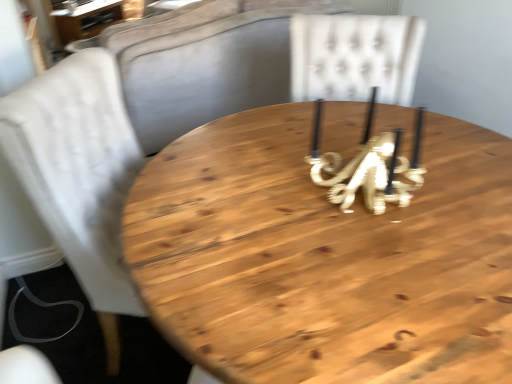
Locate an element on the screen. This screenshot has width=512, height=384. white fabric chair at left is located at coordinates (80, 174).

From a real-world perspective, which table is the 1st one underneath the white fabric chair at left? Please provide its 2D coordinates.

[(324, 258)]

From a real-world perspective, which object rests below the other?

natural wood table at center, which appears as the 1th table when viewed from the front.

Considering the sizes of objects natural wood table at center, which appears as the 1th table when ordered from the bottom, and white fabric chair at left in the image provided, who is taller, natural wood table at center, which appears as the 1th table when ordered from the bottom, or white fabric chair at left?

natural wood table at center, which appears as the 1th table when ordered from the bottom, is taller.

Is there a large distance between natural wood table at center, which ranks as the 2th table in left-to-right order, and white fabric chair at left?

They are positioned close to each other.

From the image's perspective, which object appears higher, wooden table at upper left, which ranks as the second table in front-to-back order, or white fabric chair at left?

wooden table at upper left, which ranks as the second table in front-to-back order, is shown above in the image.

Does wooden table at upper left, which is the 1th table in top-to-bottom order, come behind white fabric chair at left?

Yes, it is behind white fabric chair at left.

In order to click on table that is behind the white fabric chair at left in this screenshot , I will do `click(87, 19)`.

Can you confirm if wooden table at upper left, which is the 1th table in top-to-bottom order, is wider than white fabric chair at left?

No.

Which of these two, wooden table at upper left, acting as the 1th table starting from the left, or natural wood table at center, arranged as the 2th table when viewed from the back, stands shorter?

wooden table at upper left, acting as the 1th table starting from the left, is shorter.

From the image's perspective, would you say wooden table at upper left, which is the 1th table in top-to-bottom order, is shown under natural wood table at center, which appears as the 1th table when ordered from the bottom?

No.

Based on their sizes in the image, would you say wooden table at upper left, which is the 1th table in top-to-bottom order, is bigger or smaller than natural wood table at center, which is the first table from right to left?

Clearly, wooden table at upper left, which is the 1th table in top-to-bottom order, is smaller in size than natural wood table at center, which is the first table from right to left.

From a real-world perspective, is wooden table at upper left, which is the 1th table in back-to-front order, under natural wood table at center, which appears as the 1th table when viewed from the front?

Correct, in the physical world, wooden table at upper left, which is the 1th table in back-to-front order, is lower than natural wood table at center, which appears as the 1th table when viewed from the front.

From the image's perspective, is white fabric chair at left on wooden table at upper left, acting as the 1th table starting from the left?

No.

Is white fabric chair at left shorter than wooden table at upper left, which ranks as the second table in bottom-to-top order?

In fact, white fabric chair at left may be taller than wooden table at upper left, which ranks as the second table in bottom-to-top order.

Is white fabric chair at left far away from wooden table at upper left, which is the 1th table in back-to-front order?

Yes, white fabric chair at left and wooden table at upper left, which is the 1th table in back-to-front order, are located far from each other.

Based on the photo, is natural wood table at center, which appears as the 1th table when viewed from the front, in contact with wooden table at upper left, the second table when ordered from right to left?

No, natural wood table at center, which appears as the 1th table when viewed from the front, is not touching wooden table at upper left, the second table when ordered from right to left.

From the image's perspective, relative to wooden table at upper left, which is the 1th table in back-to-front order, is natural wood table at center, which is the first table from right to left, above or below?

Clearly, from the image's perspective, natural wood table at center, which is the first table from right to left, is below wooden table at upper left, which is the 1th table in back-to-front order.

From a real-world perspective, is natural wood table at center, arranged as the 2th table when viewed from the back, over wooden table at upper left, which is the 1th table in back-to-front order?

Yes, from a real-world perspective, natural wood table at center, arranged as the 2th table when viewed from the back, is over wooden table at upper left, which is the 1th table in back-to-front order

Which object is closer to the camera taking this photo, natural wood table at center, which appears as the 1th table when ordered from the bottom, or wooden table at upper left, acting as the 1th table starting from the left?

natural wood table at center, which appears as the 1th table when ordered from the bottom, is closer to the camera.

Which of these two, white fabric chair at left or natural wood table at center, arranged as the 2th table when viewed from the back, stands shorter?

white fabric chair at left is shorter.

Consider the image. Is white fabric chair at left directly adjacent to natural wood table at center, which ranks as the 2th table in left-to-right order?

white fabric chair at left and natural wood table at center, which ranks as the 2th table in left-to-right order, are clearly separated.

Considering the points (42, 80) and (324, 144), which point is in front, point (42, 80) or point (324, 144)?

Point (42, 80)

In terms of size, does white fabric chair at left appear bigger or smaller than natural wood table at center, which appears as the 1th table when ordered from the bottom?

Clearly, white fabric chair at left is larger in size than natural wood table at center, which appears as the 1th table when ordered from the bottom.

The height and width of the screenshot is (384, 512). I want to click on table in front of the white fabric chair at left, so click(324, 258).

Image resolution: width=512 pixels, height=384 pixels. I want to click on table behind the white fabric chair at left, so click(x=87, y=19).

Which object lies nearer to the anchor point white fabric chair at left, wooden table at upper left, which ranks as the second table in bottom-to-top order, or natural wood table at center, arranged as the 2th table when viewed from the back?

Based on the image, natural wood table at center, arranged as the 2th table when viewed from the back, appears to be nearer to white fabric chair at left.

Considering their positions, is wooden table at upper left, which ranks as the second table in front-to-back order, positioned closer to natural wood table at center, which is the first table from right to left, than white fabric chair at left?

The object closer to natural wood table at center, which is the first table from right to left, is white fabric chair at left.

Estimate the real-world distances between objects in this image. Which object is closer to wooden table at upper left, which ranks as the second table in front-to-back order, natural wood table at center, which is the second table in top-to-bottom order, or white fabric chair at left?

Among the two, white fabric chair at left is located nearer to wooden table at upper left, which ranks as the second table in front-to-back order.

Estimate the real-world distances between objects in this image. Which object is closer to natural wood table at center, which ranks as the 2th table in left-to-right order, white fabric chair at left or wooden table at upper left, the second table when ordered from right to left?

Based on the image, white fabric chair at left appears to be nearer to natural wood table at center, which ranks as the 2th table in left-to-right order.

From the image, which object appears to be nearer to wooden table at upper left, the second table when ordered from right to left, white fabric chair at left or natural wood table at center, arranged as the 2th table when viewed from the back?

Based on the image, white fabric chair at left appears to be nearer to wooden table at upper left, the second table when ordered from right to left.

When comparing their distances from white fabric chair at left, does natural wood table at center, which appears as the 1th table when viewed from the front, or wooden table at upper left, which ranks as the second table in bottom-to-top order, seem further?

wooden table at upper left, which ranks as the second table in bottom-to-top order, is further to white fabric chair at left.

This screenshot has width=512, height=384. What are the coordinates of `chair located between natural wood table at center, which is the first table from right to left, and wooden table at upper left, which is the 1th table in top-to-bottom order, in the depth direction` in the screenshot? It's located at (80, 174).